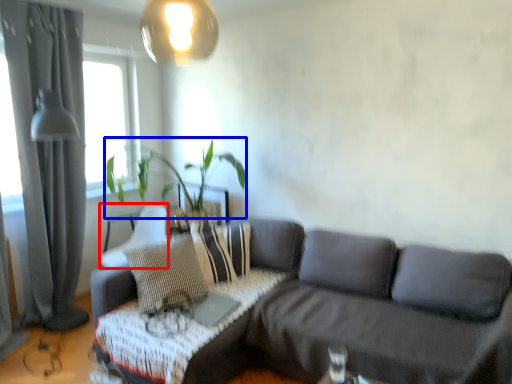
Question: Among these objects, which one is farthest to the camera, armchair (highlighted by a red box) or plant (highlighted by a blue box)?

Choices:
 (A) armchair
 (B) plant

Answer: (A)